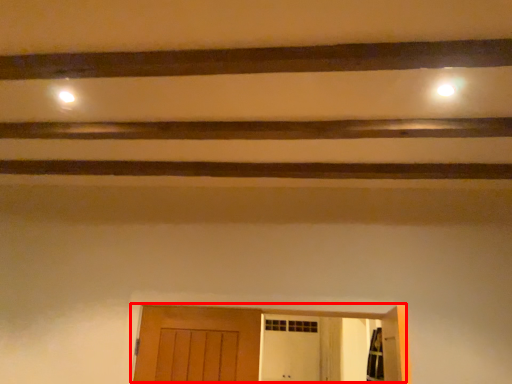
Question: From the image, what is the correct spatial relationship of door (annotated by the red box) in relation to plank?

Choices:
 (A) left
 (B) right

Answer: (B)